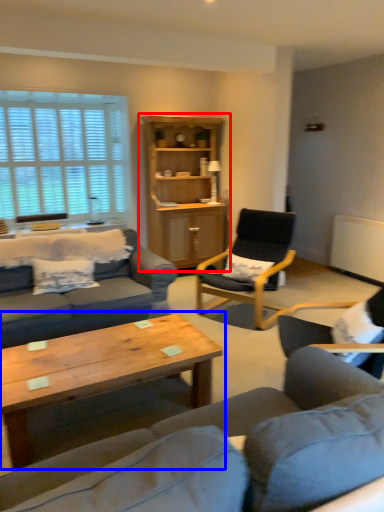
Question: Which object is closer to the camera taking this photo, cabinetry (highlighted by a red box) or coffee table (highlighted by a blue box)?

Choices:
 (A) cabinetry
 (B) coffee table

Answer: (B)